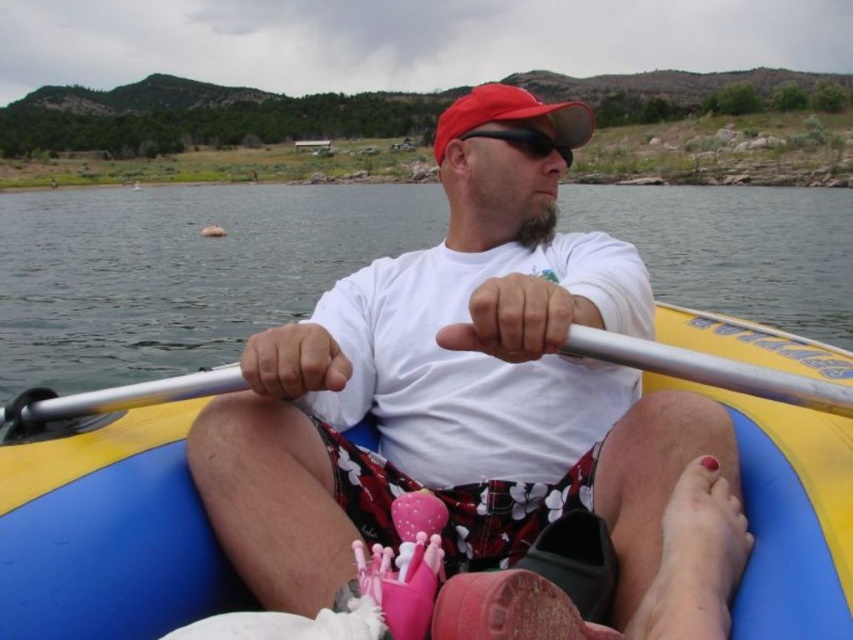
Where is the transparent water at center located in the image?

The transparent water at center is located at point 0.425 on the x axis and 0.211 on the y axis.